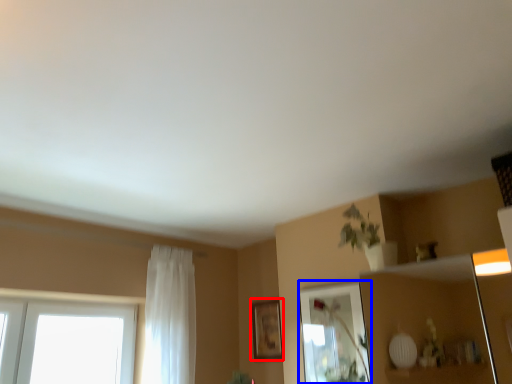
Question: Which object appears farthest to the camera in this image, picture frame (highlighted by a red box) or mirror (highlighted by a blue box)?

Choices:
 (A) picture frame
 (B) mirror

Answer: (A)